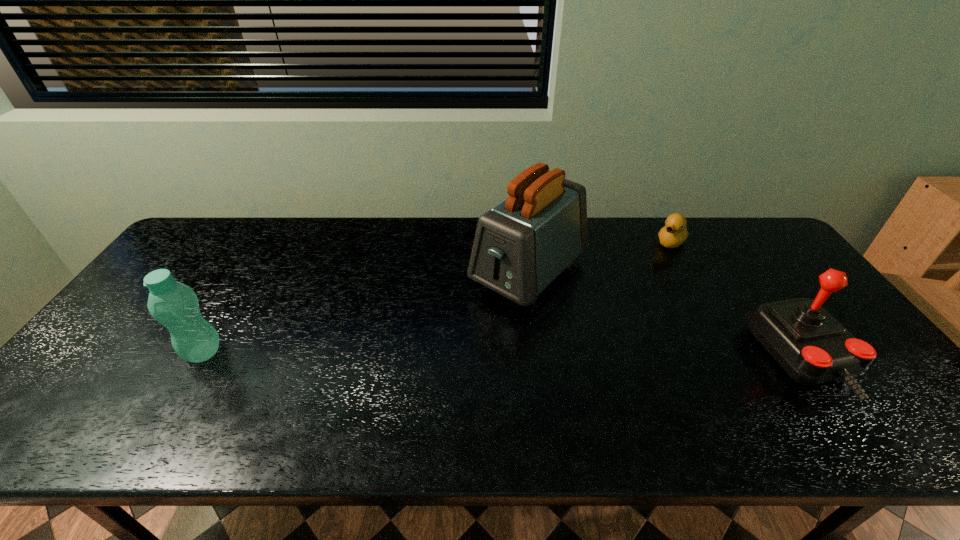
This screenshot has width=960, height=540. I want to click on blank region between the third object from right to left and the second object from right to left, so click(600, 257).

Where is `free space between the leftmost object and the toaster`? free space between the leftmost object and the toaster is located at coordinates (366, 313).

Identify which object is the nearest to the joystick. Please provide its 2D coordinates. Your answer should be formatted as a tuple, i.e. [(x, y)], where the tuple contains the x and y coordinates of a point satisfying the conditions above.

[(674, 233)]

The height and width of the screenshot is (540, 960). What are the coordinates of `object identified as the closest to the toaster` in the screenshot? It's located at (674, 233).

The image size is (960, 540). What are the coordinates of `vacant region that satisfies the following two spatial constraints: 1. on the back side of the leftmost object; 2. on the left side of the third object from right to left` in the screenshot? It's located at (252, 273).

Locate an element on the screen. Image resolution: width=960 pixels, height=540 pixels. vacant region that satisfies the following two spatial constraints: 1. on the front side of the rightmost object; 2. on the right side of the leftmost object is located at coordinates click(x=199, y=359).

At what (x,y) coordinates should I click in order to perform the action: click on vacant space that satisfies the following two spatial constraints: 1. on the front side of the joystick; 2. on the left side of the third object from right to left. Please return your answer as a coordinate pair (x, y). Looking at the image, I should click on (540, 359).

Find the location of `blank space that satisfies the following two spatial constraints: 1. on the back side of the bottle; 2. on the left side of the third object from right to left`. blank space that satisfies the following two spatial constraints: 1. on the back side of the bottle; 2. on the left side of the third object from right to left is located at coordinates (252, 273).